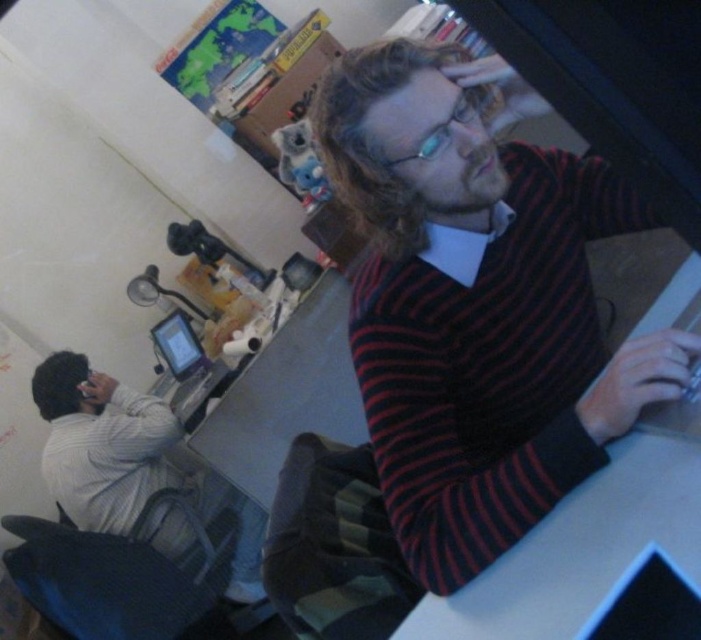
Question: Does striped sweater at center appear over matte black tablet at center?

Choices:
 (A) yes
 (B) no

Answer: (A)

Question: Which of the following is the closest to the observer?

Choices:
 (A) (550, 436)
 (B) (573, 541)

Answer: (B)

Question: From the image, what is the correct spatial relationship of striped sweater at center in relation to light gray sweater at left?

Choices:
 (A) below
 (B) above

Answer: (B)

Question: Is white plastic computer desk at center above matte black tablet at center?

Choices:
 (A) no
 (B) yes

Answer: (A)

Question: Considering the real-world distances, which object is farthest from the striped sweater at center?

Choices:
 (A) white plastic computer desk at center
 (B) light gray sweater at left

Answer: (B)

Question: Which point is closer to the camera?

Choices:
 (A) (676, 520)
 (B) (179, 312)

Answer: (A)